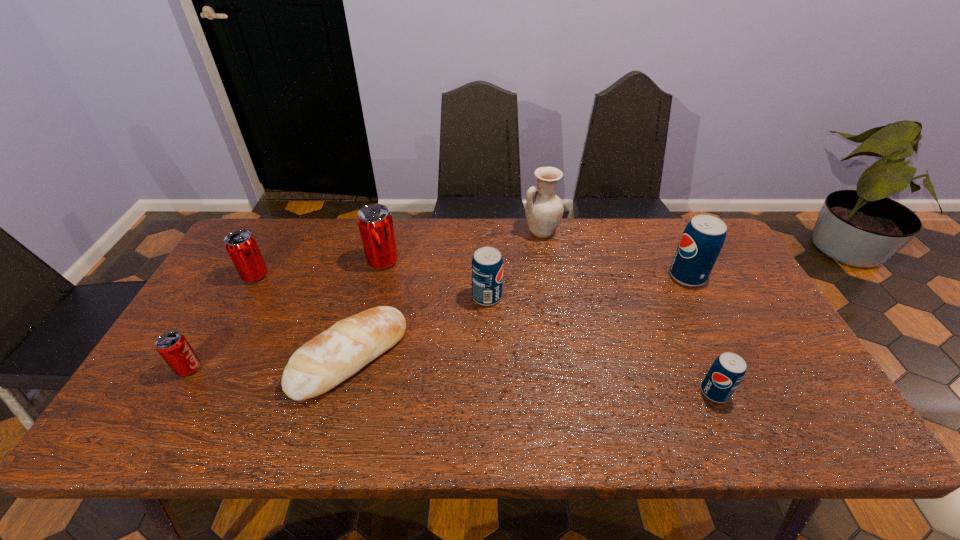
The image size is (960, 540). I want to click on vacant space located on the right of the bread, so click(458, 357).

Identify the location of pottery present at the far edge. The width and height of the screenshot is (960, 540). (544, 210).

Where is `soda can positioned at the far edge`? soda can positioned at the far edge is located at coordinates (375, 223).

You are a GUI agent. You are given a task and a screenshot of the screen. Output one action in this format:
    pyautogui.click(x=<x>, y=<y>)
    Task: Click on the object that is at the right edge
    The width and height of the screenshot is (960, 540).
    Given the screenshot: What is the action you would take?
    pyautogui.click(x=703, y=238)

The width and height of the screenshot is (960, 540). In the image, there is a desktop. Find the location of `free space at the far edge`. free space at the far edge is located at coordinates (413, 251).

At what (x,y) coordinates should I click in order to perform the action: click on free spot at the near edge of the desktop. Please return your answer as a coordinate pair (x, y). The width and height of the screenshot is (960, 540). Looking at the image, I should click on (228, 421).

In the image, there is a desktop. Where is `free space at the right edge`? free space at the right edge is located at coordinates (763, 399).

The image size is (960, 540). In order to click on vacant region at the far left corner of the desktop in this screenshot , I will do `click(259, 218)`.

The height and width of the screenshot is (540, 960). I want to click on vacant area at the near left corner of the desktop, so click(x=185, y=414).

You are a GUI agent. You are given a task and a screenshot of the screen. Output one action in this format:
    pyautogui.click(x=<x>, y=<y>)
    Task: Click on the vacant position at the near right corner of the desktop
    
    Given the screenshot: What is the action you would take?
    pyautogui.click(x=790, y=425)